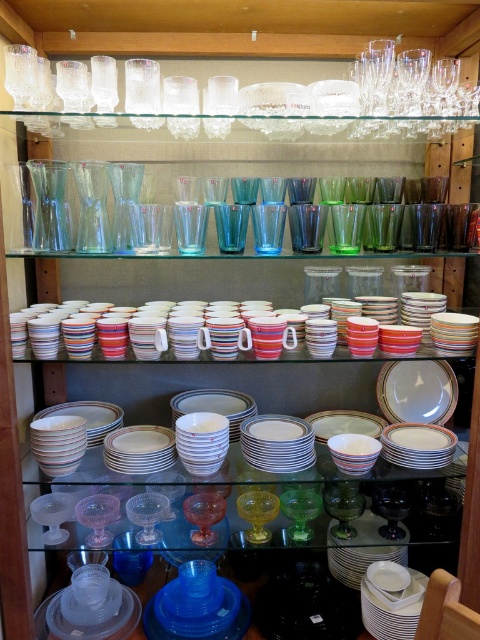
Does striped ceramic mug at center have a lesser width compared to translucent yellow glass at center?

In fact, striped ceramic mug at center might be wider than translucent yellow glass at center.

Does striped ceramic mug at center appear on the right side of translucent yellow glass at center?

In fact, striped ceramic mug at center is to the left of translucent yellow glass at center.

Image resolution: width=480 pixels, height=640 pixels. Find the location of `striped ceramic mug at center`. striped ceramic mug at center is located at coordinates (227, 332).

Is point (216, 307) positioned behind point (393, 413)?

That is False.

What are the coordinates of `striped ceramic mug at center` in the screenshot? It's located at (227, 332).

You are a GUI agent. You are given a task and a screenshot of the screen. Output one action in this format:
    pyautogui.click(x=<x>, y=<y>)
    Task: Click on the striped ceramic mug at center
    
    Given the screenshot: What is the action you would take?
    pyautogui.click(x=227, y=332)

Does white glossy plate at center come behind translucent yellow glass at center?

Yes, white glossy plate at center is further from the viewer.

Between white glossy plate at center and translucent yellow glass at center, which one is positioned higher?

Positioned higher is white glossy plate at center.

Does point (417, 392) lie in front of point (247, 496)?

That is False.

I want to click on white glossy plate at center, so click(417, 392).